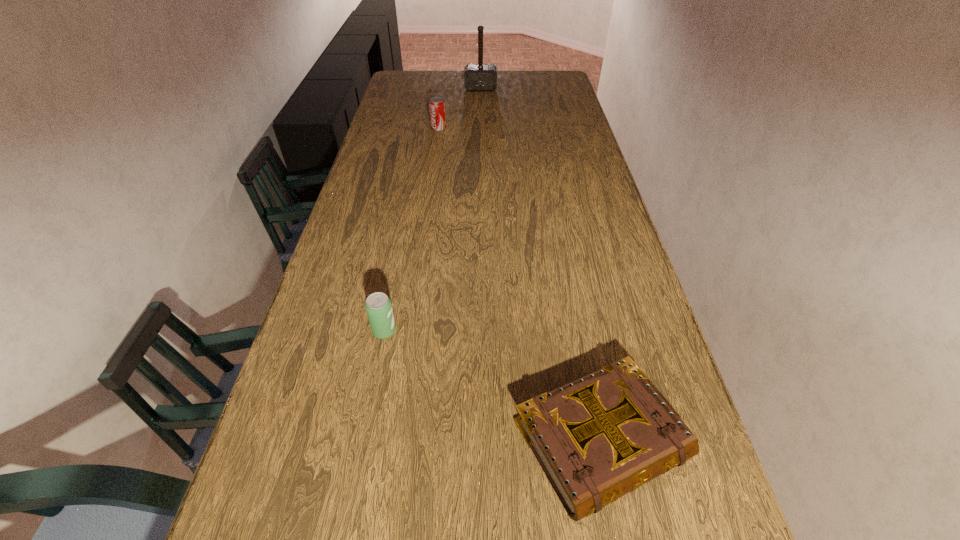
This screenshot has width=960, height=540. In order to click on vacant region that satisfies the following two spatial constraints: 1. on the logo side of the farther soda; 2. on the front side of the third farthest object in this screenshot , I will do `click(410, 330)`.

Where is `free location that satisfies the following two spatial constraints: 1. on the front side of the nearer soda; 2. on the right side of the hardback book`? free location that satisfies the following two spatial constraints: 1. on the front side of the nearer soda; 2. on the right side of the hardback book is located at coordinates (364, 440).

The image size is (960, 540). In order to click on vacant space that satisfies the following two spatial constraints: 1. on the logo side of the third object from right to left; 2. on the front side of the nearer soda in this screenshot , I will do `click(410, 330)`.

I want to click on free location that satisfies the following two spatial constraints: 1. on the logo side of the right soda; 2. on the back side of the nearest object, so click(x=395, y=440).

The image size is (960, 540). Find the location of `vacant point that satisfies the following two spatial constraints: 1. on the logo side of the right soda; 2. on the front side of the second nearest object`. vacant point that satisfies the following two spatial constraints: 1. on the logo side of the right soda; 2. on the front side of the second nearest object is located at coordinates (410, 330).

This screenshot has width=960, height=540. Find the location of `vacant region that satisfies the following two spatial constraints: 1. on the logo side of the second object from left to right; 2. on the left side of the nearest object`. vacant region that satisfies the following two spatial constraints: 1. on the logo side of the second object from left to right; 2. on the left side of the nearest object is located at coordinates (395, 440).